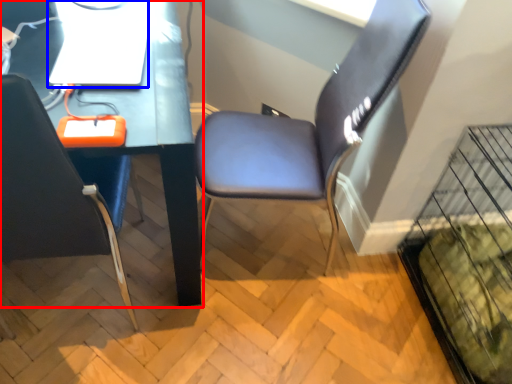
Question: Which point is further to the camera, computer desk (highlighted by a red box) or computer (highlighted by a blue box)?

Choices:
 (A) computer desk
 (B) computer

Answer: (B)